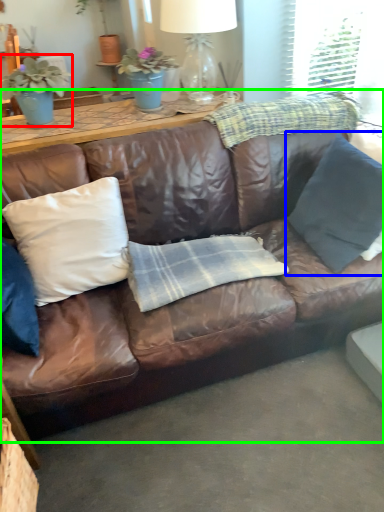
Question: Considering the real-world distances, which object is farthest from houseplant (highlighted by a red box)? pillow (highlighted by a blue box) or studio couch (highlighted by a green box)?

Choices:
 (A) pillow
 (B) studio couch

Answer: (A)